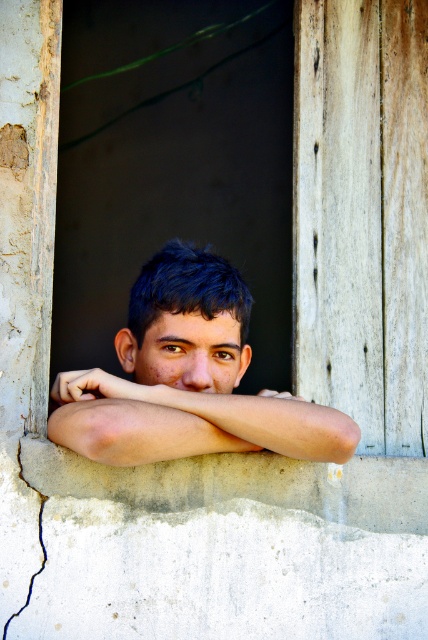
You are an architect designing a new building and want to ensure that the window design allows for a clear view of the smooth skin face at center from the exterior. Based on the window dimensions and the face position, can you confirm if the face will be visible through the open window?

The smooth skin face at center is positioned at coordinates (x=187, y=378) within the window frame, which means it is centrally located and within the open window area. Therefore, the face will be clearly visible from the outside when the window is open.

Based on the scene description and the coordinates provided, what is located at the point with coordinates [187,378]?

The point at coordinates [187,378] indicates the location of the smooth skin face at center.

Based on the photo, you are a painter observing the scene. You need to paint the smooth skin face at center and the smooth skin arm at center. Which one should you paint first if you follow the standard painting technique of starting from the background and moving to the foreground?

The smooth skin face at center should be painted first because it is above the smooth skin arm at center, indicating it is closer to the foreground and thus should be painted after the background but before the foreground elements. Wait, actually, standard painting technique usually starts with the background and moves towards the foreground. Since the face is above the arm, meaning it is closer to the viewer, it would be part of the foreground. Therefore, you should paint the smooth skin arm at center, the